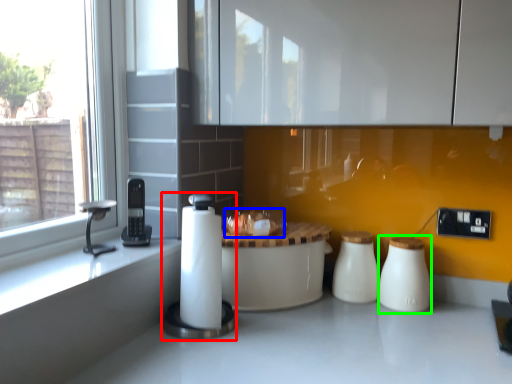
Question: Which object is positioned closest to appliance (highlighted by a red box)? Select from food (highlighted by a blue box) and salt shaker (highlighted by a green box).

Choices:
 (A) food
 (B) salt shaker

Answer: (A)